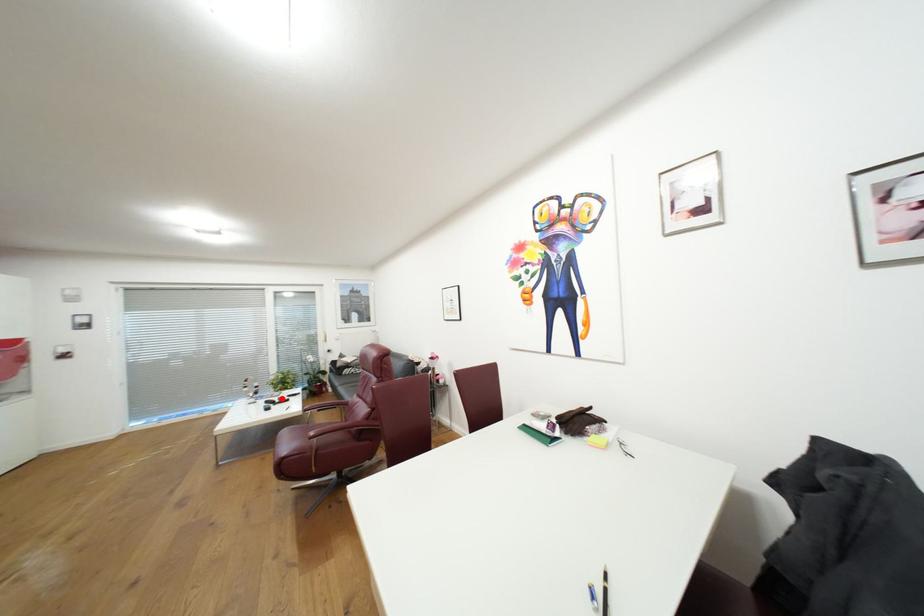
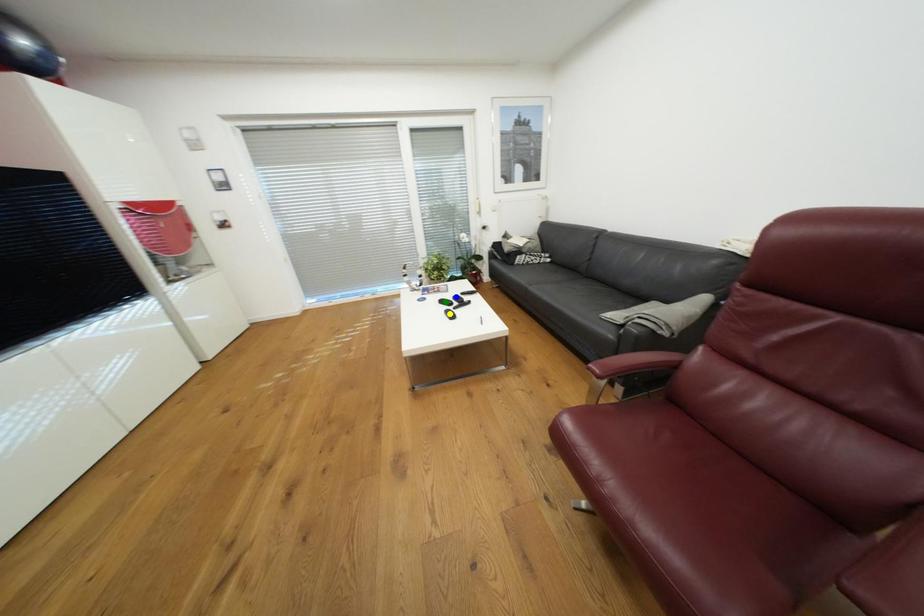
Question: I am providing you with two images of the same scene from different viewpoints. A red point is marked on the first image. You are given multiple points on the second image. In image 2, which mark is for the same physical point as the one in image 1?

Choices:
 (A) green point
 (B) yellow point
 (C) blue point

Answer: (C)